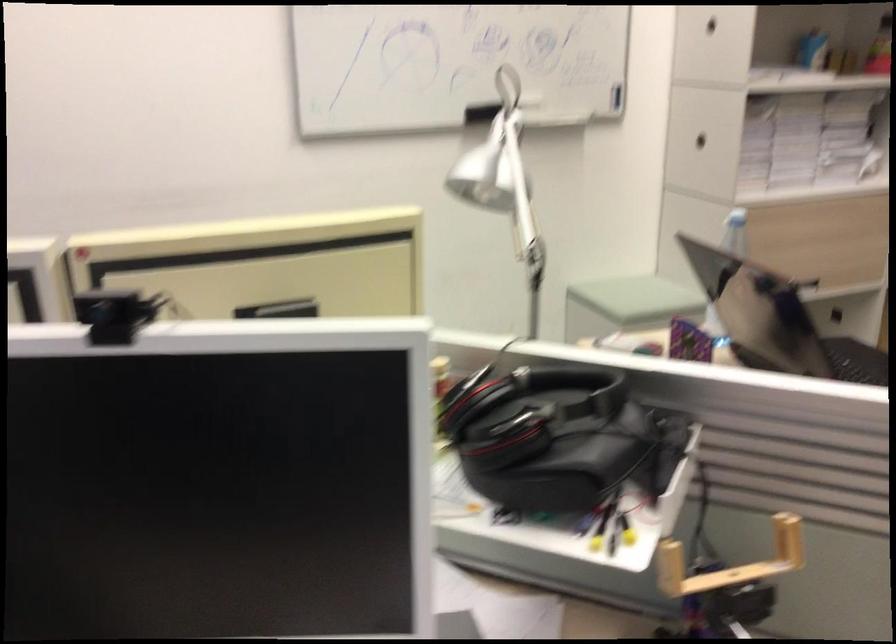
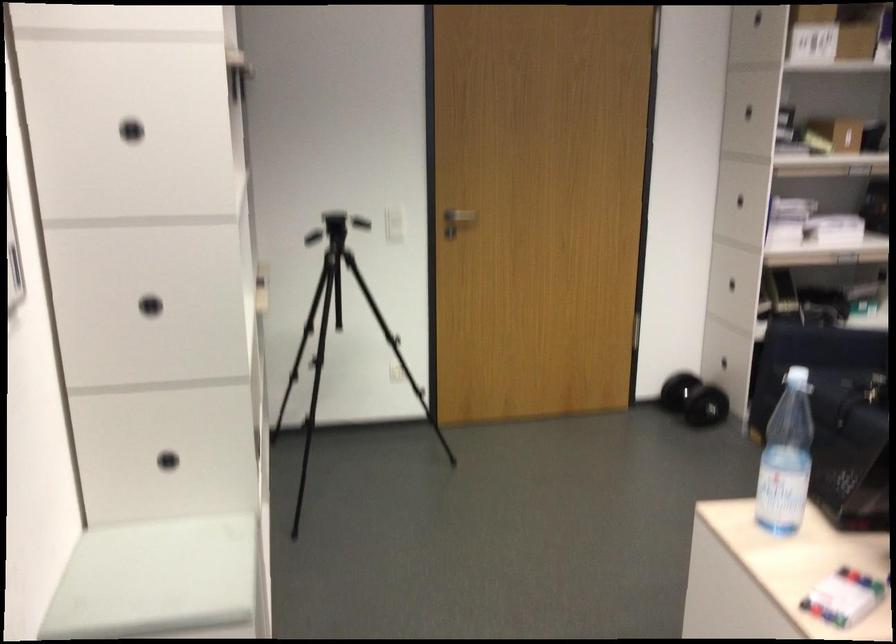
Where in the second image is the point corresponding to the point at 745,142 from the first image?

(150, 305)